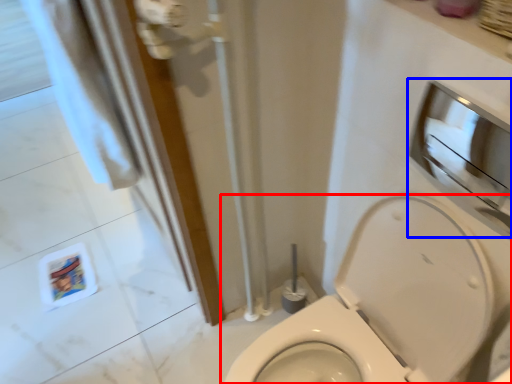
Question: Which of the following is the closest to the observer, toilet (highlighted by a red box) or medicine cabinet (highlighted by a blue box)?

Choices:
 (A) toilet
 (B) medicine cabinet

Answer: (A)